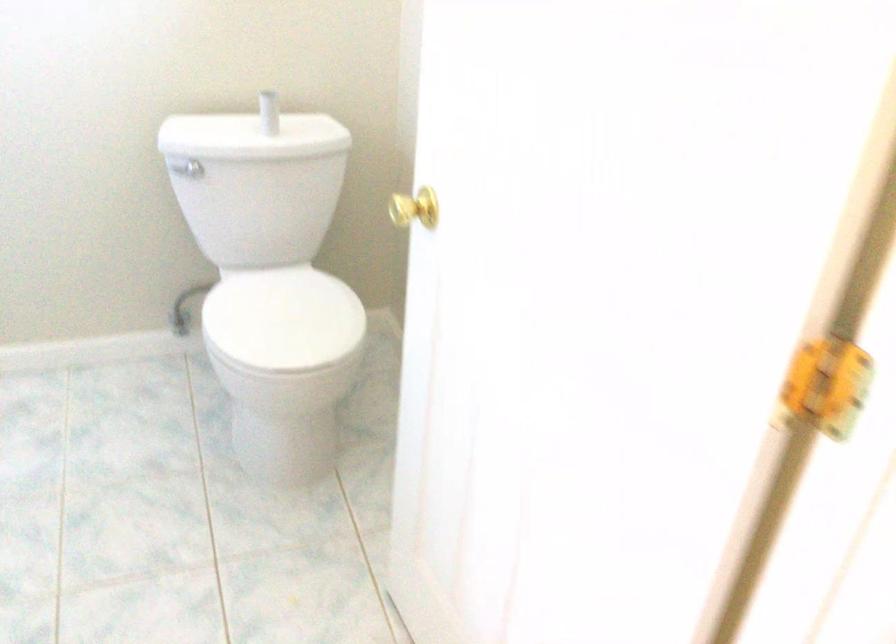
What do you see at coordinates (194, 167) in the screenshot? I see `the toilet flush lever` at bounding box center [194, 167].